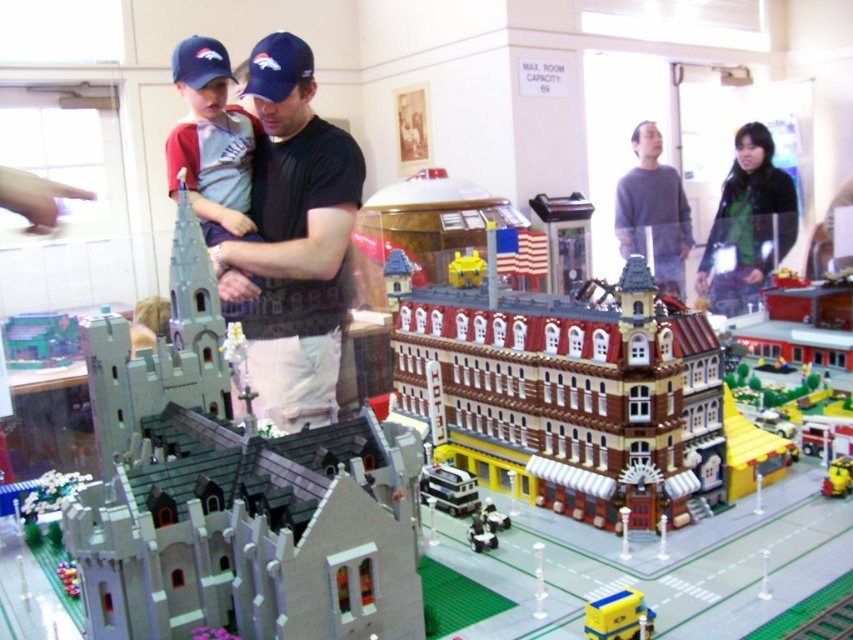
Question: Which object is positioned farthest from the yellow plastic toy at center?

Choices:
 (A) yellow plastic car at center
 (B) black fabric shirt at center

Answer: (A)

Question: Which is farther from the matte blue cap at center?

Choices:
 (A) white plastic car at center
 (B) blue fabric baseball cap at center

Answer: (A)

Question: Which object is positioned farthest from the yellow matte toy car at lower center?

Choices:
 (A) blue fabric baseball cap at center
 (B) gray lego castle at left

Answer: (A)

Question: Does black fabric shirt at center appear on the right side of blue fabric baseball cap at center?

Choices:
 (A) no
 (B) yes

Answer: (B)

Question: Does gray lego castle at left appear on the left side of yellow plastic car at center?

Choices:
 (A) yes
 (B) no

Answer: (A)

Question: Can you confirm if gray lego castle at left is positioned above white plastic car at center?

Choices:
 (A) no
 (B) yes

Answer: (B)